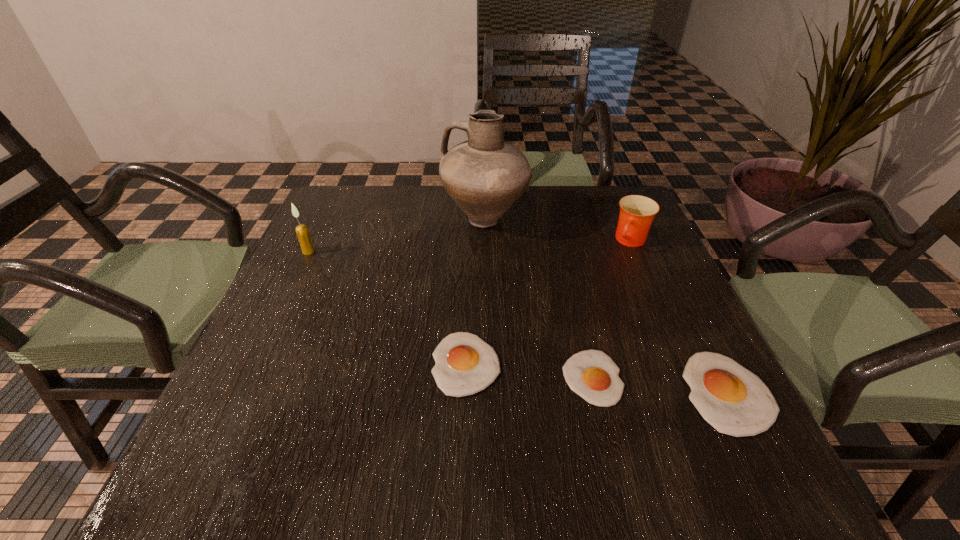
Locate an element on the screen. free space located 0.110m on the left of the shortest egg yolk is located at coordinates [x=505, y=378].

Find the location of `vacant space located on the left of the rightmost egg yolk`. vacant space located on the left of the rightmost egg yolk is located at coordinates (646, 393).

Where is `vacant area located on the handle side of the pitcher`? Image resolution: width=960 pixels, height=540 pixels. vacant area located on the handle side of the pitcher is located at coordinates (352, 220).

At what (x,y) coordinates should I click in order to perform the action: click on free space located on the handle side of the pitcher. Please return your answer as a coordinate pair (x, y). Image resolution: width=960 pixels, height=540 pixels. Looking at the image, I should click on (363, 220).

Where is `vacant region located on the handle side of the pitcher`? vacant region located on the handle side of the pitcher is located at coordinates (355, 220).

Locate an element on the screen. The width and height of the screenshot is (960, 540). blank space located on the left of the cup is located at coordinates (463, 241).

Where is `blank space located on the right of the second tallest object`? This screenshot has height=540, width=960. blank space located on the right of the second tallest object is located at coordinates (373, 252).

The width and height of the screenshot is (960, 540). What are the coordinates of `pitcher that is positioned at the far edge` in the screenshot? It's located at (485, 176).

I want to click on cup located at the far edge, so click(637, 212).

I want to click on object at the left edge, so click(302, 231).